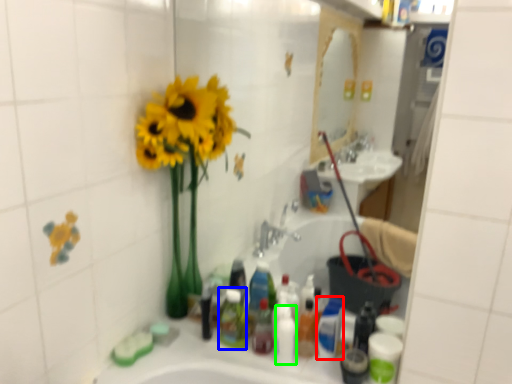
Question: Which object is the closest to the mouthwash (highlighted by a red box)? Choose among these: toiletry (highlighted by a blue box) or toiletry (highlighted by a green box).

Choices:
 (A) toiletry
 (B) toiletry

Answer: (B)